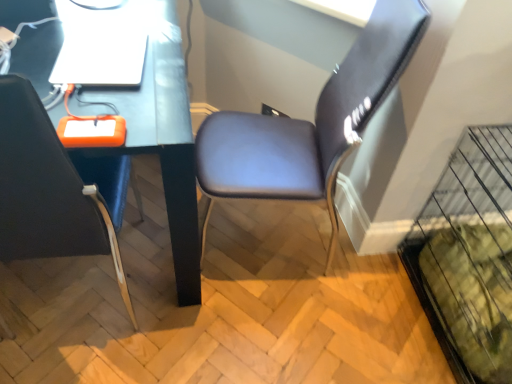
The width and height of the screenshot is (512, 384). Find the location of `vacant location below white glossy laptop at upper left (from a real-world perspective)`. vacant location below white glossy laptop at upper left (from a real-world perspective) is located at coordinates (109, 43).